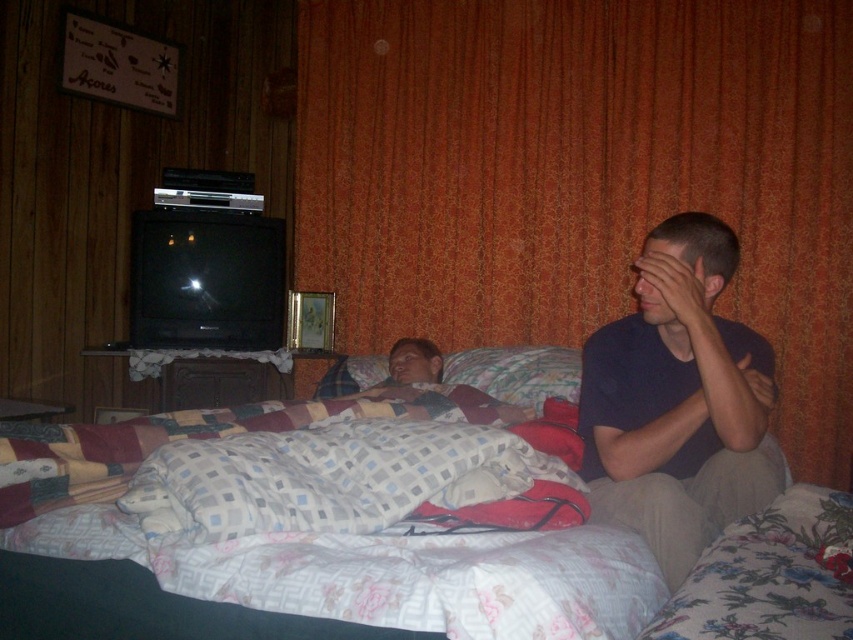
You are a tailor who needs to place a 30 inch wide fabric roll on the bed between the dark blue shirt at center and the fluffy fabric pillow at center. Can the fabric roll fit between them?

The distance between the dark blue shirt at center and the fluffy fabric pillow at center is 33.41 inches, which is wider than the 30 inch fabric roll. Therefore, the fabric roll can fit between them.

You are organizing a closet and see the dark blue shirt at center and the fluffy fabric pillow at center in the bedroom. Which item is positioned to the right side when viewed from the front?

The dark blue shirt at center is to the right of the fluffy fabric pillow at center, so the dark blue shirt at center is positioned to the right side.

You are standing in the bedroom and want to place a small plant exactly at the point labeled as point [283,580]. If your arm reaches 3 feet, can you comfortably place the plant there without moving your feet?

The distance of point [283,580] from camera is 3.58 feet, so the plant is slightly out of reach since your arm only reaches 3 feet. You might need to take a step forward or use a tool to place it.